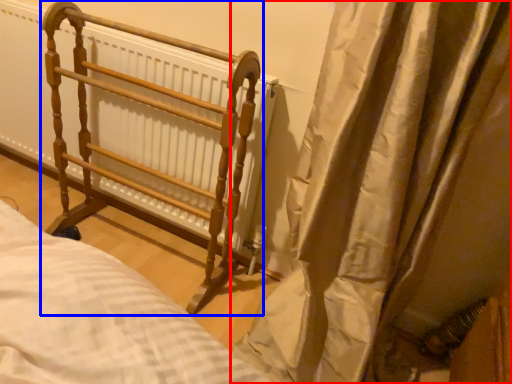
Question: Which point is closer to the camera, curtain (highlighted by a red box) or furniture (highlighted by a blue box)?

Choices:
 (A) curtain
 (B) furniture

Answer: (A)